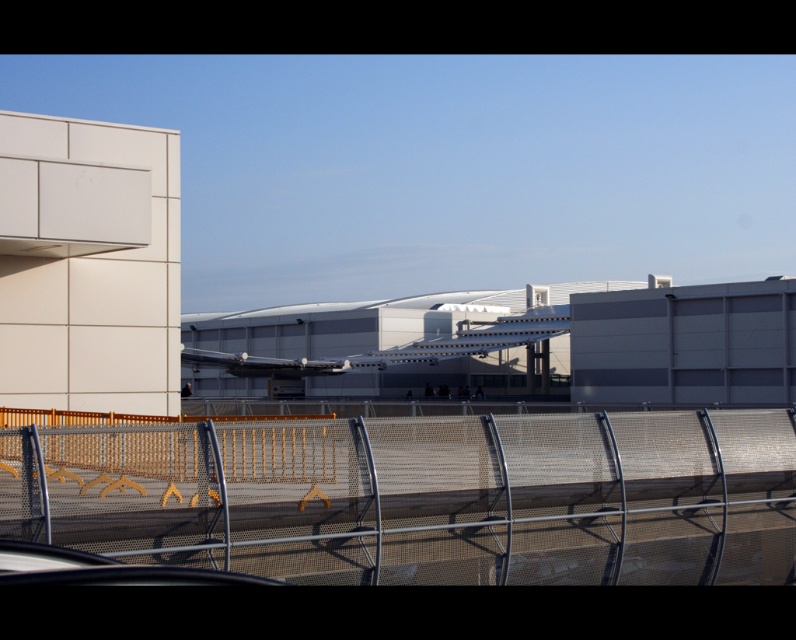
Question: Is metal mesh fence at center positioned behind white metallic airliner at center?

Choices:
 (A) no
 (B) yes

Answer: (A)

Question: Does metal mesh fence at center have a smaller size compared to white metallic airliner at center?

Choices:
 (A) no
 (B) yes

Answer: (B)

Question: Among these objects, which one is farthest from the camera?

Choices:
 (A) white metallic airliner at center
 (B) metal mesh fence at center

Answer: (A)

Question: Does metal mesh fence at center lie in front of white metallic airliner at center?

Choices:
 (A) no
 (B) yes

Answer: (B)

Question: Which object appears farthest from the camera in this image?

Choices:
 (A) metal mesh fence at center
 (B) white metallic airliner at center

Answer: (B)

Question: Which of the following is the closest to the observer?

Choices:
 (A) (306, 422)
 (B) (494, 324)

Answer: (A)